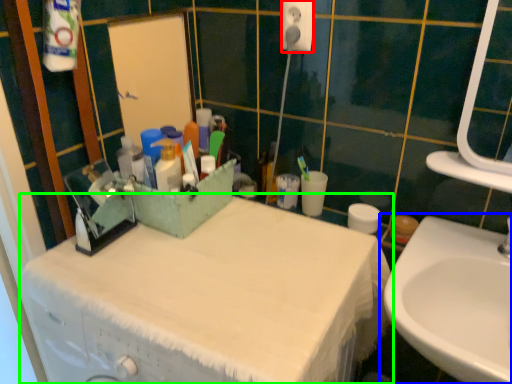
Question: Which object is positioned closest to electric outlet (highlighted by a red box)? Select from sink (highlighted by a blue box) and bathroom cabinet (highlighted by a green box).

Choices:
 (A) sink
 (B) bathroom cabinet

Answer: (B)